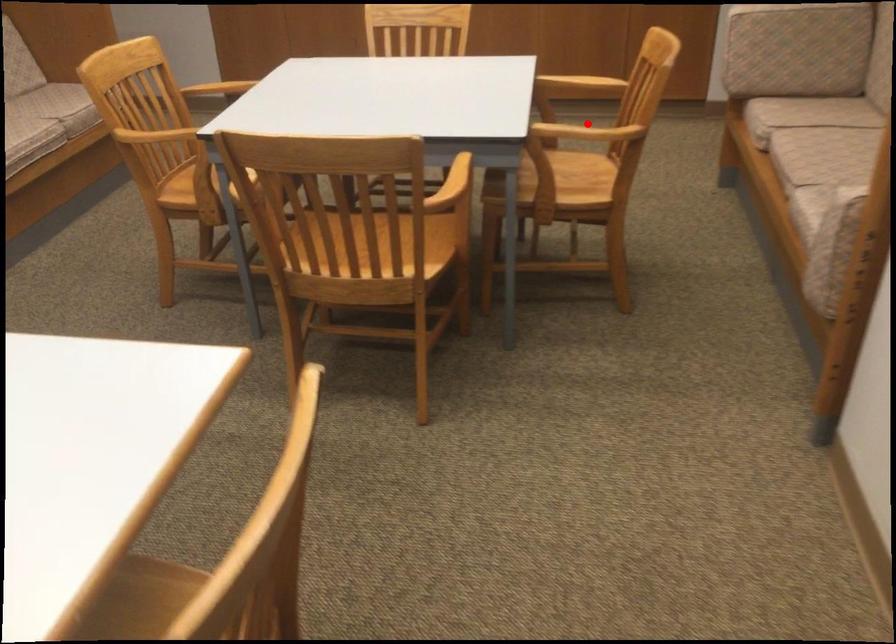
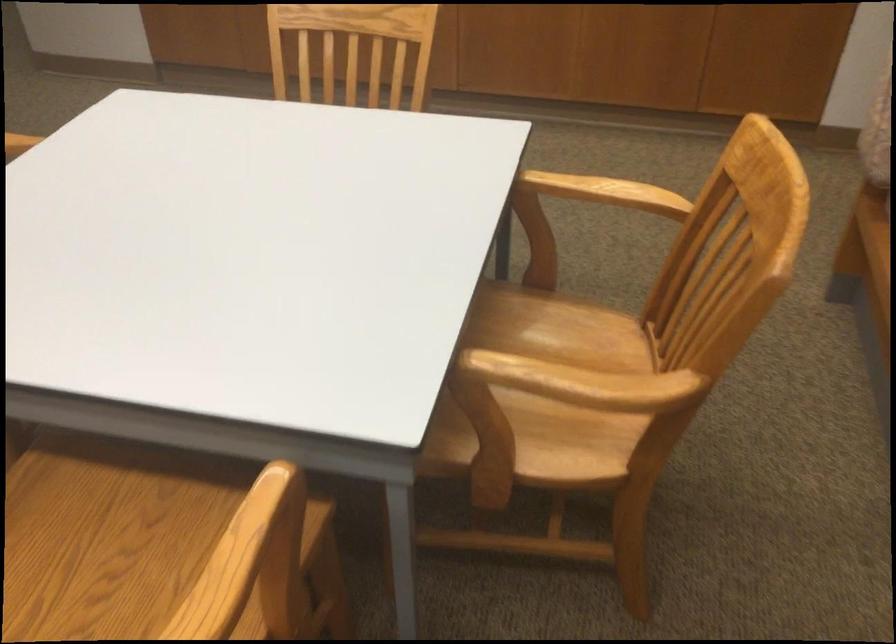
Question: I am providing you with two images of the same scene from different viewpoints. Image1 has a red point marked. In image2, the corresponding 3D location appears at what relative position? Reply with the corresponding letter.

Choices:
 (A) Closer
 (B) Farther

Answer: (A)